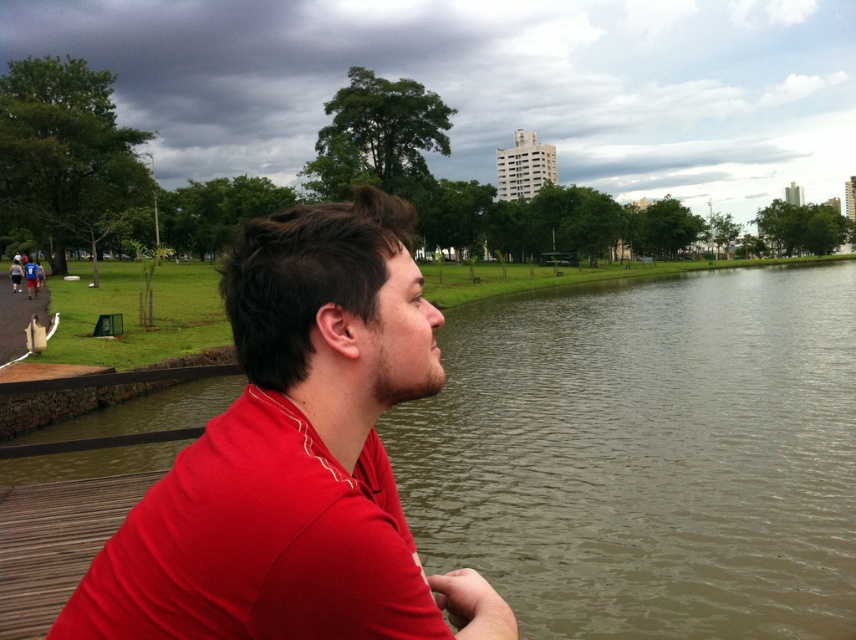
You are standing at the point labeled point (116, 595) and want to walk to the point labeled point (117, 534). Which direction should you move in to reach your destination?

To reach point (117, 534) from point (116, 595), you should move backward since point (116, 595) is in front of point (117, 534).

You are a photographer trying to capture the entire scene of the brown murky water at center and the matte red shirt at center in one shot. Based on their sizes, which object should you focus on to ensure both are visible without cropping?

The brown murky water at center has a larger size compared to the matte red shirt at center, so you should focus on the brown murky water at center to ensure both objects are visible in the frame.

You are an observer standing on the dock and see the matte red shirt at center and the matte red polo shirt at center. Which one is closer to you?

The matte red shirt at center is closer to you because it is in front of the matte red polo shirt at center.